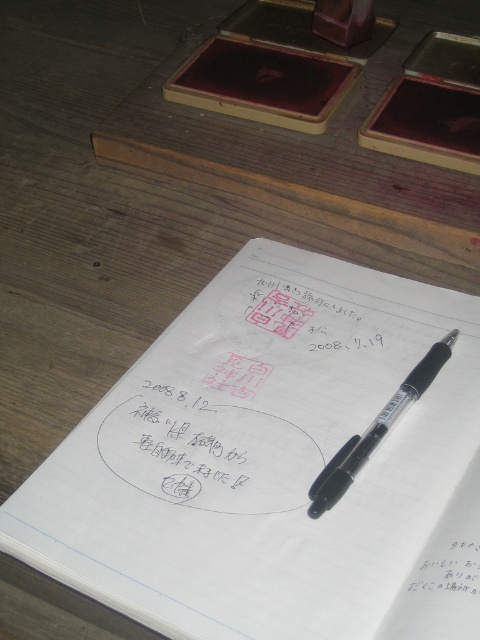
Who is more forward, (405,612) or (203,419)?

Point (405,612) is in front.

Locate an element on the screen. Image resolution: width=480 pixels, height=640 pixels. white paper notebook at center is located at coordinates 268,461.

Does transparent plastic pen at center lie behind white paper at lower right?

That is True.

Where is `transparent plastic pen at center`? The width and height of the screenshot is (480, 640). transparent plastic pen at center is located at coordinates (375, 429).

Find the location of a particular element. transparent plastic pen at center is located at coordinates (375, 429).

Does white paper notebook at center appear on the right side of white paper at lower right?

No, white paper notebook at center is not to the right of white paper at lower right.

Can you confirm if white paper notebook at center is positioned above white paper at lower right?

Yes.

I want to click on white paper notebook at center, so click(268, 461).

Find the location of `white paper notebook at center`. white paper notebook at center is located at coordinates (268, 461).